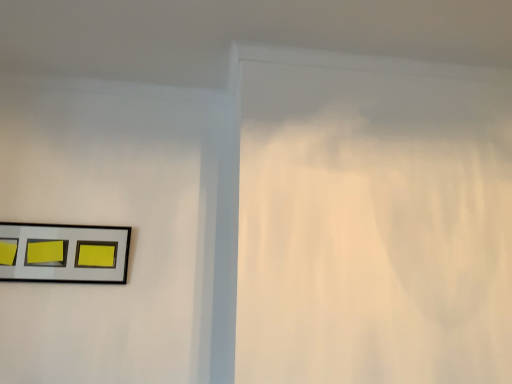
Question: Should I look upward or downward to see metallic silver picture frame at upper left?

Choices:
 (A) down
 (B) up

Answer: (A)